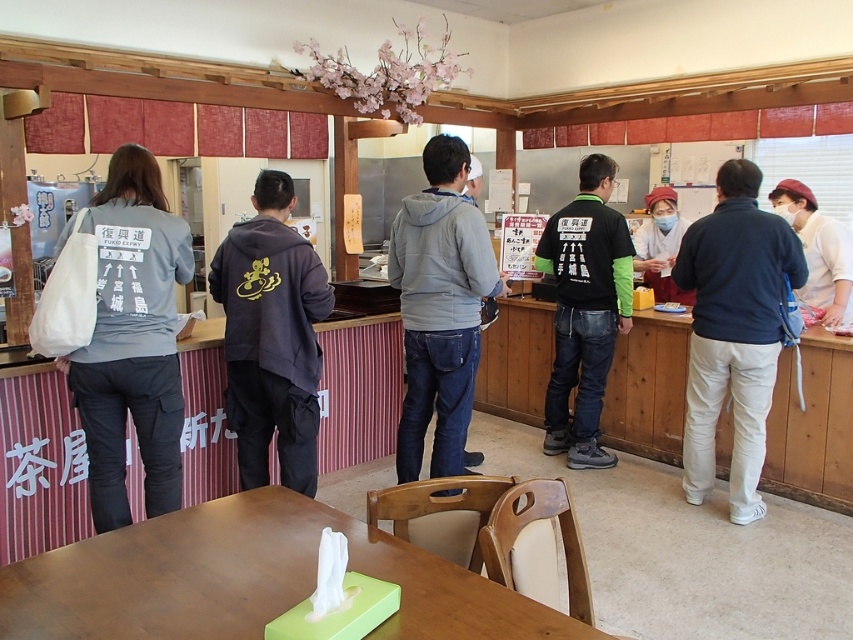
You are a customer entering the cafe and want to sit at the green matte table at lower center. However, there is a black matte jacket at center hanging on the back of the chair. Can you easily sit down without moving the jacket?

The green matte table at lower center is shorter than the black matte jacket at center, so when sitting down, the jacket might hang lower than the table. However, since the jacket is on the chair back, you can likely sit without moving it as the table height doesn

You are sitting at the wooden table with the green tissue box and want to reach both the point at coordinates (231, 262) and the point at (825, 284). Which point is closer to you?

The point at coordinates (231, 262) is closer to you than the point at (825, 284).

You are trying to find the dark gray hoodie at center in the image. Based on the coordinates provided, where exactly would you look first?

The dark gray hoodie at center is located at point coordinates (271,337).